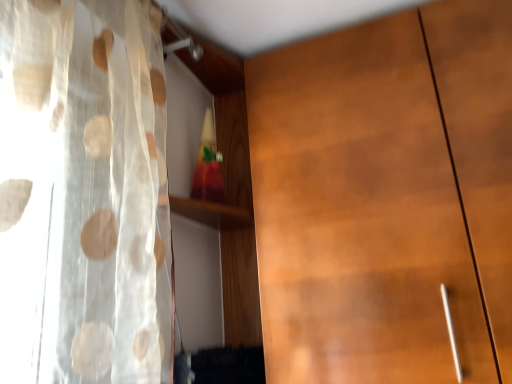
This screenshot has width=512, height=384. Describe the element at coordinates (385, 198) in the screenshot. I see `wooden cabinet at right` at that location.

Measure the distance between wooden cabinet at right and camera.

The distance of wooden cabinet at right from camera is 33.11 inches.

The width and height of the screenshot is (512, 384). What are the coordinates of `wooden cabinet at right` in the screenshot? It's located at (385, 198).

This screenshot has height=384, width=512. What are the coordinates of `wooden cabinet at right` in the screenshot? It's located at (385, 198).